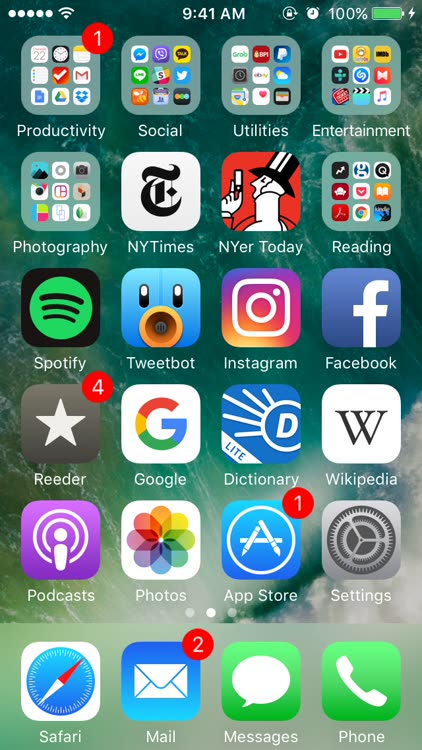
At what (x,y) coordinates should I click in order to perform the action: click on photos. Please return your answer as a coordinate pair (x, y). Looking at the image, I should click on (138, 597).